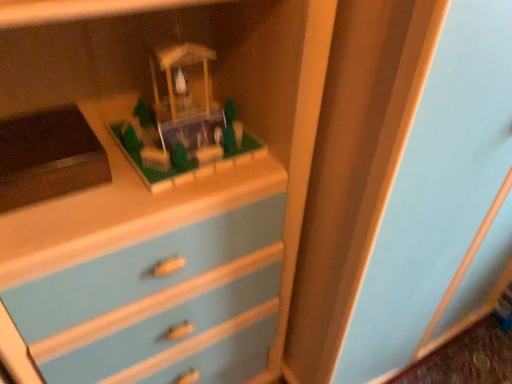
Measure the distance between wooden birdhouse at center and camera.

The depth of wooden birdhouse at center is 29.13 inches.

The image size is (512, 384). Identify the location of wooden birdhouse at center. (183, 122).

Describe the element at coordinates (183, 122) in the screenshot. This screenshot has width=512, height=384. I see `wooden birdhouse at center` at that location.

Locate an element on the screen. wooden birdhouse at center is located at coordinates (183, 122).